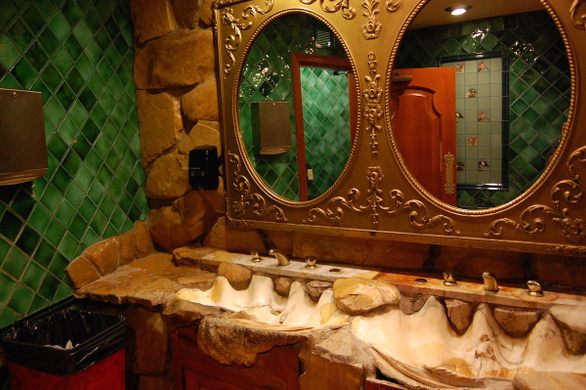
What are the coordinates of `right mirror` in the screenshot? It's located at (422, 1), (387, 65), (391, 146), (446, 209), (524, 199), (571, 129), (572, 47), (548, 2).